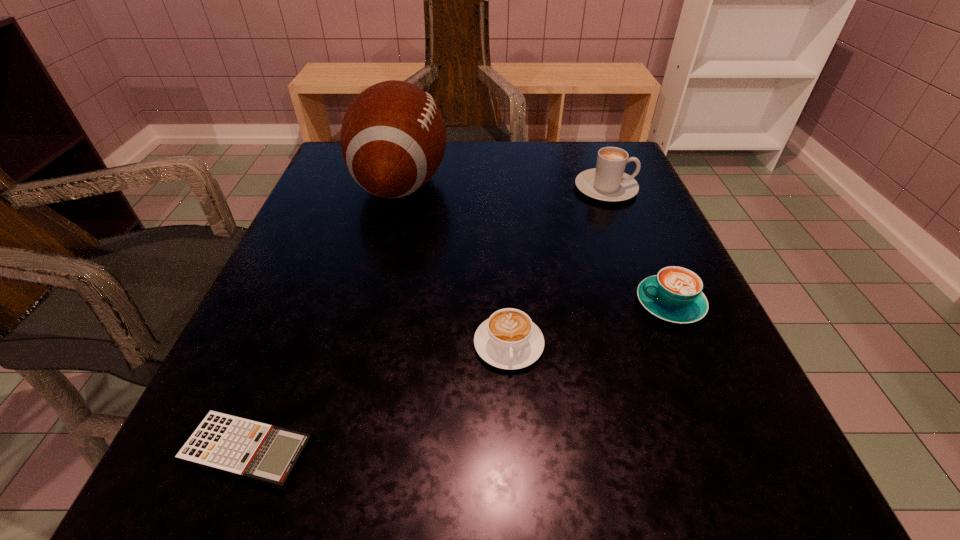
Where is `vacant space at the right edge of the desktop`? vacant space at the right edge of the desktop is located at coordinates (592, 253).

Locate an element on the screen. The image size is (960, 540). free space at the far left corner of the desktop is located at coordinates (328, 173).

In the image, there is a desktop. Identify the location of free space at the near left corner. The height and width of the screenshot is (540, 960). (180, 478).

At what (x,y) coordinates should I click in order to perform the action: click on vacant area between the football and the farthest cappuccino. Please return your answer as a coordinate pair (x, y). This screenshot has width=960, height=540. Looking at the image, I should click on (503, 186).

Locate an element on the screen. The height and width of the screenshot is (540, 960). free space that is in between the fourth shortest object and the shortest cappuccino is located at coordinates pyautogui.click(x=558, y=266).

Identify the location of blank region between the tallest object and the leftmost cappuccino. (455, 264).

Locate an element on the screen. vacant space that is in between the leftmost cappuccino and the calculator is located at coordinates (378, 397).

I want to click on object that is the second closest one to the tallest object, so click(607, 182).

Identify which object is the third nearest to the leftmost cappuccino. Please provide its 2D coordinates. Your answer should be formatted as a tuple, i.e. [(x, y)], where the tuple contains the x and y coordinates of a point satisfying the conditions above.

[(393, 138)]

Identify which cappuccino is located as the third nearest to the football. Please provide its 2D coordinates. Your answer should be formatted as a tuple, i.e. [(x, y)], where the tuple contains the x and y coordinates of a point satisfying the conditions above.

[(675, 294)]